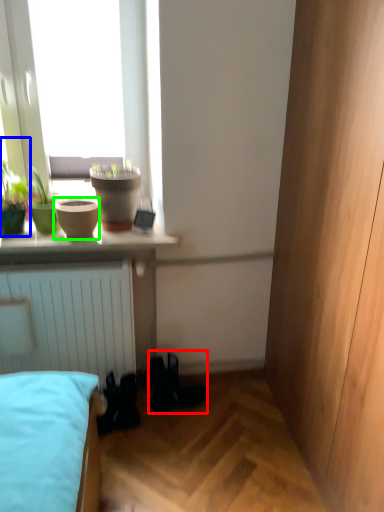
Question: Which object is positioned closest to shoe (highlighted by a red box)? Select from houseplant (highlighted by a blue box) and flowerpot (highlighted by a green box).

Choices:
 (A) houseplant
 (B) flowerpot

Answer: (B)